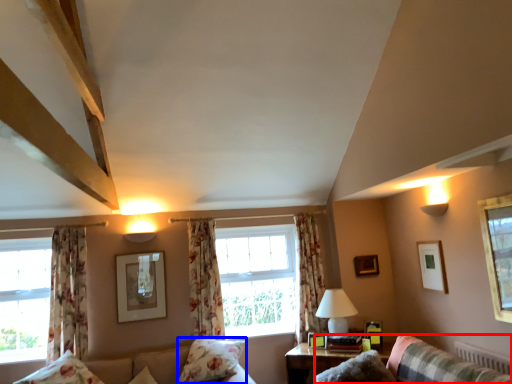
Question: Which point is closer to the camera, couch (highlighted by a red box) or pillow (highlighted by a blue box)?

Choices:
 (A) couch
 (B) pillow

Answer: (A)